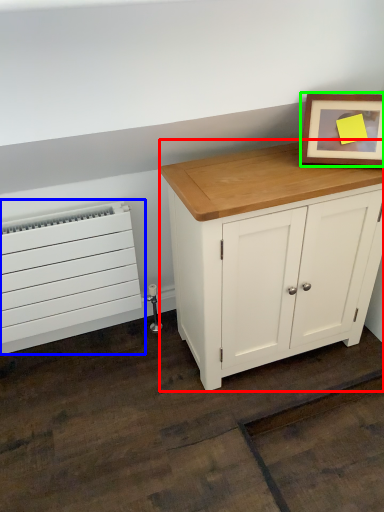
Question: Which is nearer to the chest of drawers (highlighted by a red box)? heater (highlighted by a blue box) or picture frame (highlighted by a green box).

Choices:
 (A) heater
 (B) picture frame

Answer: (B)